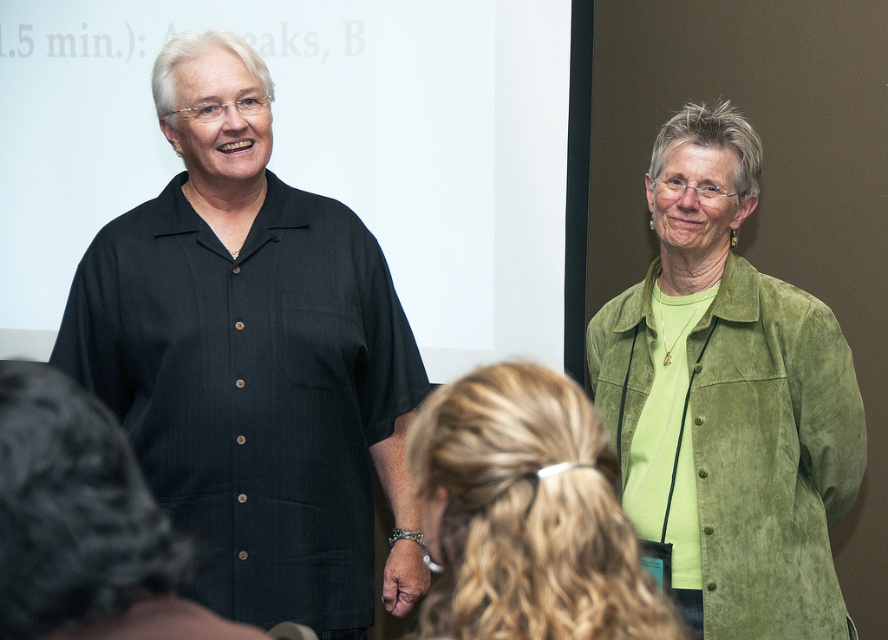
Is green suede jacket at upper right to the right of green suede jacket at center from the viewer's perspective?

Correct, you'll find green suede jacket at upper right to the right of green suede jacket at center.

Is point (799, 611) behind point (482, 436)?

Yes, it is.

Measure the distance between green suede jacket at upper right and camera.

1.91 meters

Locate an element on the screen. green suede jacket at upper right is located at coordinates (728, 400).

Does green suede jacket at center have a greater height compared to green suede shirt at right?

No.

Is green suede jacket at center further to the viewer compared to green suede shirt at right?

No, it is in front of green suede shirt at right.

This screenshot has width=888, height=640. What are the coordinates of `green suede jacket at center` in the screenshot? It's located at (526, 515).

Who is more distant from viewer, (70, 289) or (648, 596)?

The point (70, 289) is more distant.

Does black button-down shirt at left appear under green suede jacket at center?

Actually, black button-down shirt at left is above green suede jacket at center.

You are a GUI agent. You are given a task and a screenshot of the screen. Output one action in this format:
    pyautogui.click(x=<x>, y=<y>)
    Task: Click on the black button-down shirt at left
    This screenshot has height=640, width=888.
    Given the screenshot: What is the action you would take?
    pyautogui.click(x=252, y=360)